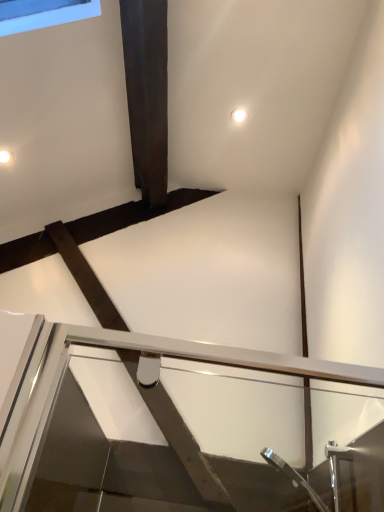
In order to face white glossy light fixture at upper center, should I rotate leftwards or rightwards?

You should rotate right by 6.537 degrees.

The height and width of the screenshot is (512, 384). Find the location of `white glossy light fixture at upper center`. white glossy light fixture at upper center is located at coordinates (239, 115).

The width and height of the screenshot is (384, 512). Describe the element at coordinates (239, 115) in the screenshot. I see `white glossy light fixture at upper center` at that location.

The width and height of the screenshot is (384, 512). What are the coordinates of `white glossy light fixture at upper center` in the screenshot? It's located at (239, 115).